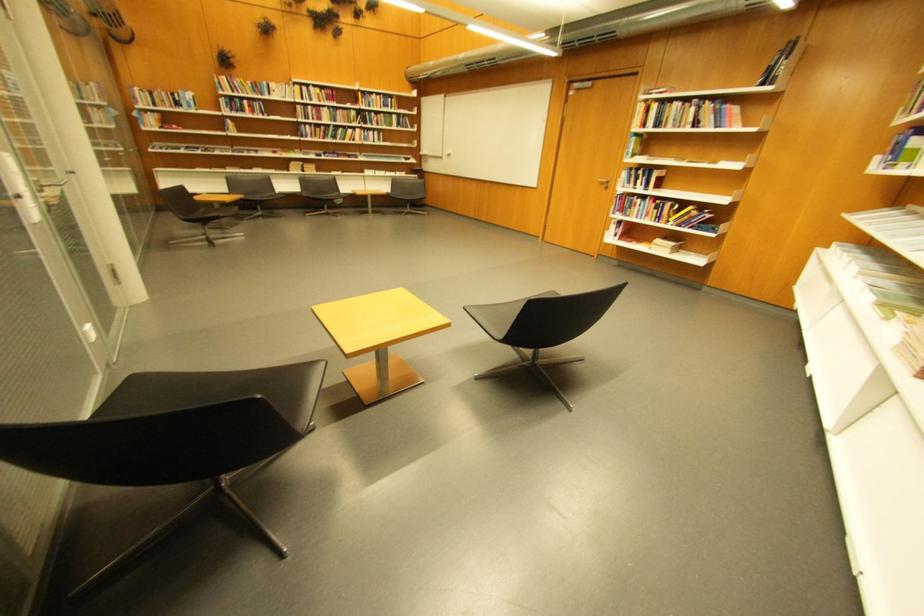
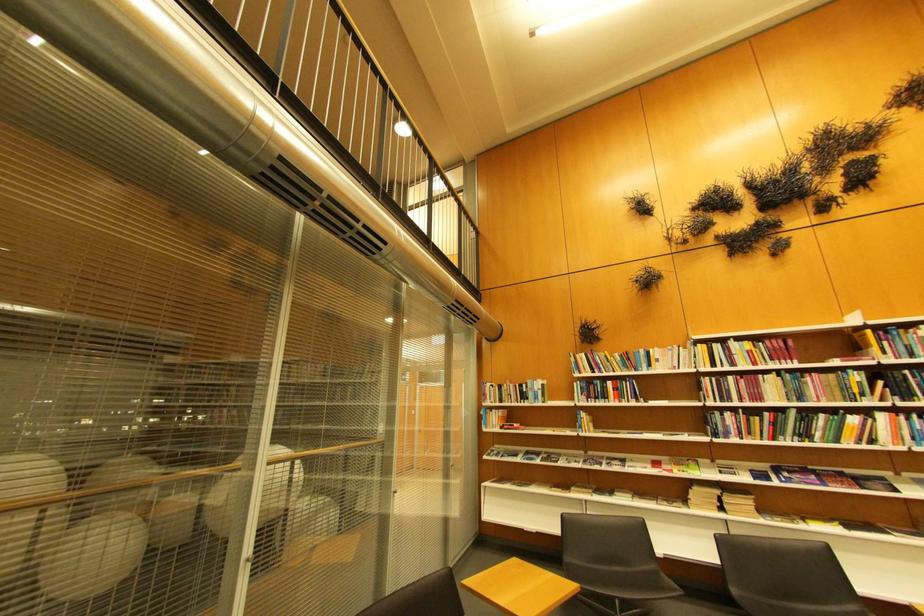
In the second image, find the point that corresponds to the point at 355,142 in the first image.

(847, 443)